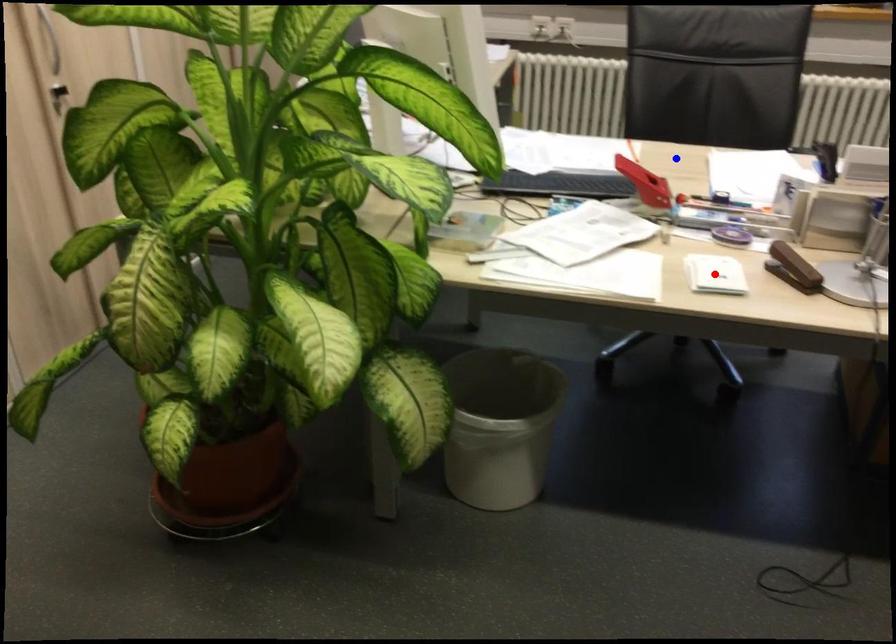
Question: In the image, two points are highlighted. Which point is nearer to the camera? Reply with the corresponding letter.

Choices:
 (A) blue point
 (B) red point

Answer: (B)